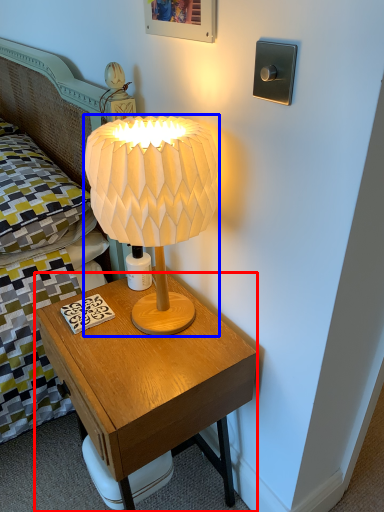
Question: Which of the following is the farthest to the observer, nightstand (highlighted by a red box) or lamp (highlighted by a blue box)?

Choices:
 (A) nightstand
 (B) lamp

Answer: (A)